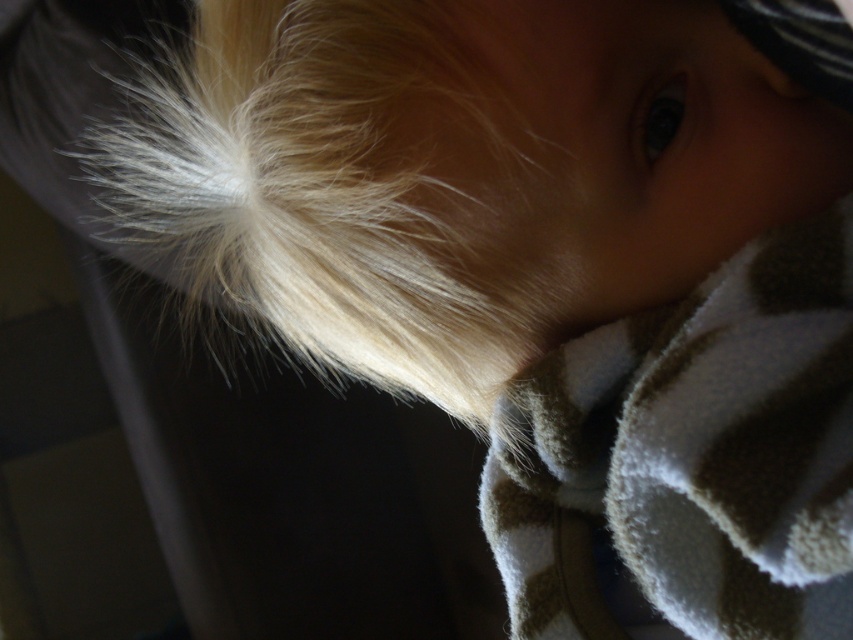
You are a photographer setting up a shot of the doll. You want to ensure the blonde silky hair at upper left and the brown fleece blanket at lower right are both visible in the frame. Which object should you adjust if you need to make space for the other?

The brown fleece blanket at lower right is behind the blonde silky hair at upper left. To make space for the other object, you should adjust the position of the brown fleece blanket at lower right since it is positioned behind and might be blocking part of the frame.

From the picture: You are a photographer taking a close up of a doll. You want to focus on the blonde silky hair at upper left. Where should you position your camera to ensure the hair is centered in the frame?

To center the blonde silky hair at upper left in the frame, position your camera so that the center of the frame aligns with the coordinates of the hair at point (355, 188).